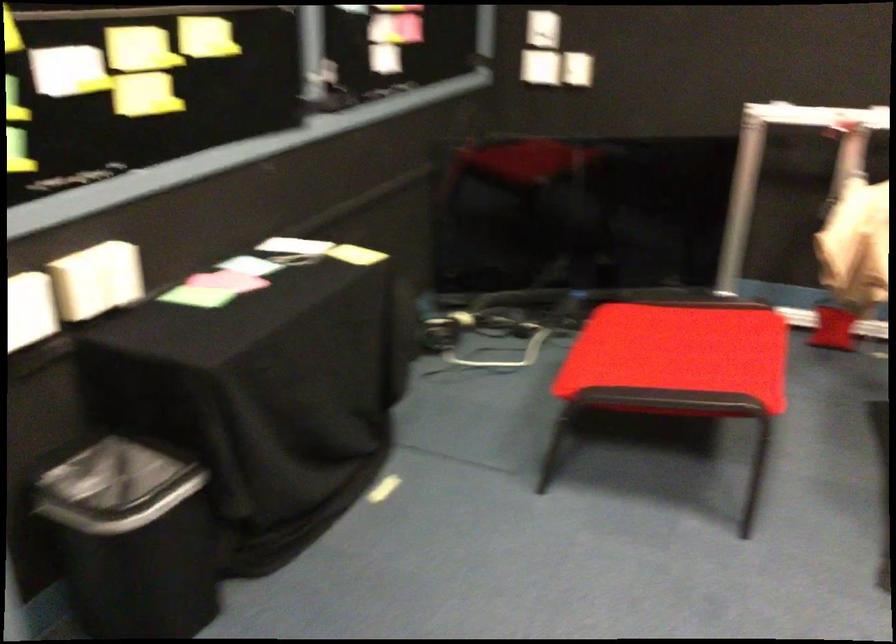
Looking at this image, the first image is from the beginning of the video and the second image is from the end. How did the camera likely rotate when shooting the video?

The camera rotated toward right-down.